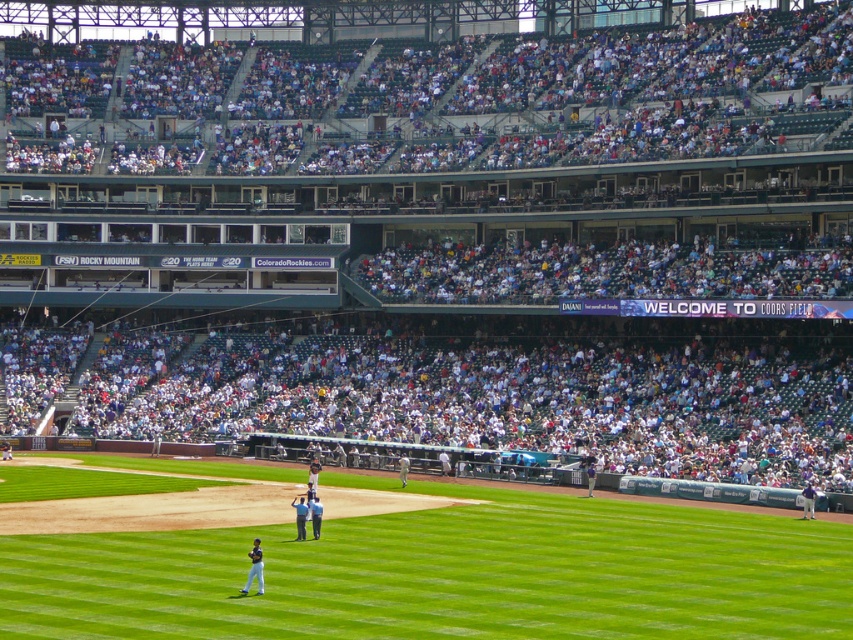
Describe the element at coordinates (254, 566) in the screenshot. I see `dark blue uniform at lower left` at that location.

Identify the location of dark blue uniform at lower left. (254, 566).

Where is `green grass at center`? This screenshot has height=640, width=853. green grass at center is located at coordinates [413, 563].

Can you confirm if green grass at center is positioned to the right of light blue uniform at center?

Yes, green grass at center is to the right of light blue uniform at center.

Describe the element at coordinates (413, 563) in the screenshot. I see `green grass at center` at that location.

This screenshot has width=853, height=640. Find the location of `green grass at center`. green grass at center is located at coordinates (413, 563).

Who is more forward, (300, 516) or (315, 525)?

Point (300, 516)

Is the position of light blue uniform at center less distant than that of blue uniformed man at center?

That is True.

Between point (294, 497) and point (318, 506), which one is positioned behind?

The point (294, 497) is behind.

Find the location of `light blue uniform at center`. light blue uniform at center is located at coordinates (300, 515).